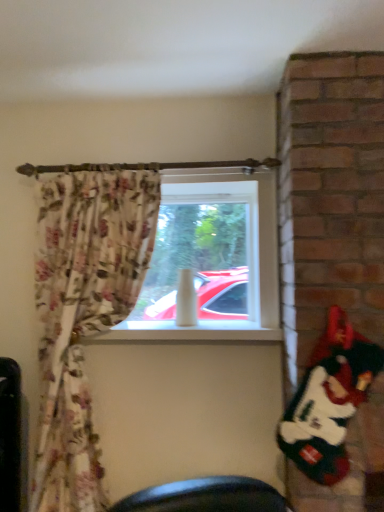
Question: From a real-world perspective, does transparent glass window at center sit lower than white plush santa at right?

Choices:
 (A) no
 (B) yes

Answer: (A)

Question: From the image's perspective, is transparent glass window at center beneath white plush santa at right?

Choices:
 (A) no
 (B) yes

Answer: (A)

Question: Considering the relative sizes of transparent glass window at center and white plush santa at right in the image provided, is transparent glass window at center bigger than white plush santa at right?

Choices:
 (A) yes
 (B) no

Answer: (A)

Question: Is transparent glass window at center wider than white plush santa at right?

Choices:
 (A) no
 (B) yes

Answer: (B)

Question: From the image's perspective, is transparent glass window at center above white plush santa at right?

Choices:
 (A) no
 (B) yes

Answer: (B)

Question: Could you tell me if transparent glass window at center is turned towards white plush santa at right?

Choices:
 (A) yes
 (B) no

Answer: (B)

Question: Does white plush santa at right lie in front of transparent glass window at center?

Choices:
 (A) yes
 (B) no

Answer: (A)

Question: Can you confirm if white plush santa at right is thinner than transparent glass window at center?

Choices:
 (A) no
 (B) yes

Answer: (B)

Question: Can you confirm if white plush santa at right is bigger than transparent glass window at center?

Choices:
 (A) no
 (B) yes

Answer: (A)

Question: Is the depth of white plush santa at right greater than that of transparent glass window at center?

Choices:
 (A) yes
 (B) no

Answer: (B)

Question: Is white plush santa at right turned away from transparent glass window at center?

Choices:
 (A) no
 (B) yes

Answer: (A)

Question: Is transparent glass window at center surrounded by white plush santa at right?

Choices:
 (A) yes
 (B) no

Answer: (B)

Question: From the image's perspective, relative to transparent glass window at center, is white plush santa at right above or below?

Choices:
 (A) above
 (B) below

Answer: (B)